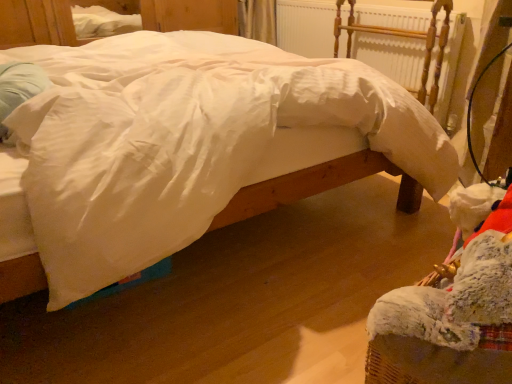
Question: Does white smooth bed at center have a smaller size compared to white soft pillow at left?

Choices:
 (A) yes
 (B) no

Answer: (B)

Question: Are white smooth bed at center and white soft pillow at left far apart?

Choices:
 (A) no
 (B) yes

Answer: (A)

Question: Is white soft pillow at left inside white smooth bed at center?

Choices:
 (A) no
 (B) yes

Answer: (B)

Question: Considering the relative sizes of white smooth bed at center and white soft pillow at left in the image provided, is white smooth bed at center shorter than white soft pillow at left?

Choices:
 (A) yes
 (B) no

Answer: (B)

Question: From a real-world perspective, is white smooth bed at center beneath white soft pillow at left?

Choices:
 (A) yes
 (B) no

Answer: (A)

Question: Can you confirm if white smooth bed at center is thinner than white soft pillow at left?

Choices:
 (A) no
 (B) yes

Answer: (A)

Question: Does white soft pillow at left come behind white smooth bed at center?

Choices:
 (A) yes
 (B) no

Answer: (A)

Question: Is white soft pillow at left oriented away from white smooth bed at center?

Choices:
 (A) no
 (B) yes

Answer: (B)

Question: Considering the relative sizes of white soft pillow at left and white smooth bed at center in the image provided, is white soft pillow at left thinner than white smooth bed at center?

Choices:
 (A) yes
 (B) no

Answer: (A)

Question: From a real-world perspective, does white soft pillow at left sit lower than white smooth bed at center?

Choices:
 (A) no
 (B) yes

Answer: (A)

Question: From a real-world perspective, is white soft pillow at left physically above white smooth bed at center?

Choices:
 (A) yes
 (B) no

Answer: (A)

Question: Can you confirm if white soft pillow at left is wider than white smooth bed at center?

Choices:
 (A) yes
 (B) no

Answer: (B)

Question: Is white painted wood radiator at upper center taller than white smooth bed at center?

Choices:
 (A) no
 (B) yes

Answer: (A)